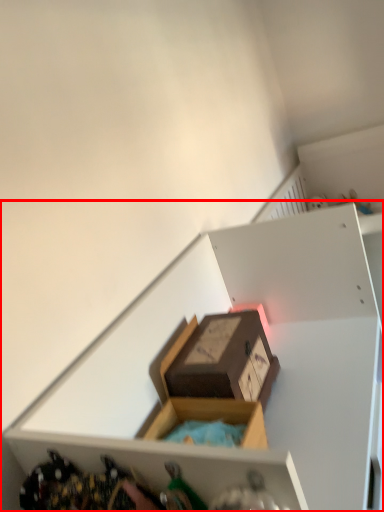
Question: Where is shelf (annotated by the red box) located in relation to box in the image?

Choices:
 (A) right
 (B) left

Answer: (A)